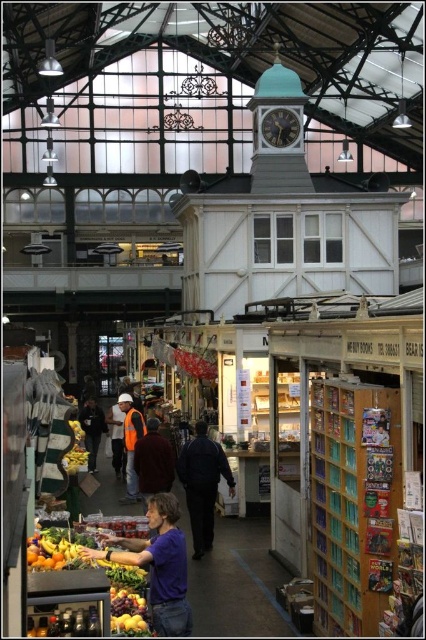
Question: Does purple cotton shirt at center appear over orange reflective vest at center?

Choices:
 (A) yes
 (B) no

Answer: (B)

Question: Does shiny yellow bananas at lower left appear on the right side of reflective orange vest at center?

Choices:
 (A) no
 (B) yes

Answer: (B)

Question: Which of the following is the closest to the observer?

Choices:
 (A) (183, 554)
 (B) (161, 467)
 (C) (94, 412)
 (D) (187, 496)

Answer: (A)

Question: From the image, what is the correct spatial relationship of dark gray stone clock at upper center in relation to orange reflective vest at center?

Choices:
 (A) below
 (B) above

Answer: (B)

Question: Which of the following is the closest to the observer?

Choices:
 (A) orange safety vest at center
 (B) reflective orange vest at center
 (C) shiny yellow bananas at center
 (D) orange reflective vest at center

Answer: (C)

Question: Which point is farther to the camera?

Choices:
 (A) (141, 429)
 (B) (147, 624)
 (C) (150, 445)

Answer: (A)